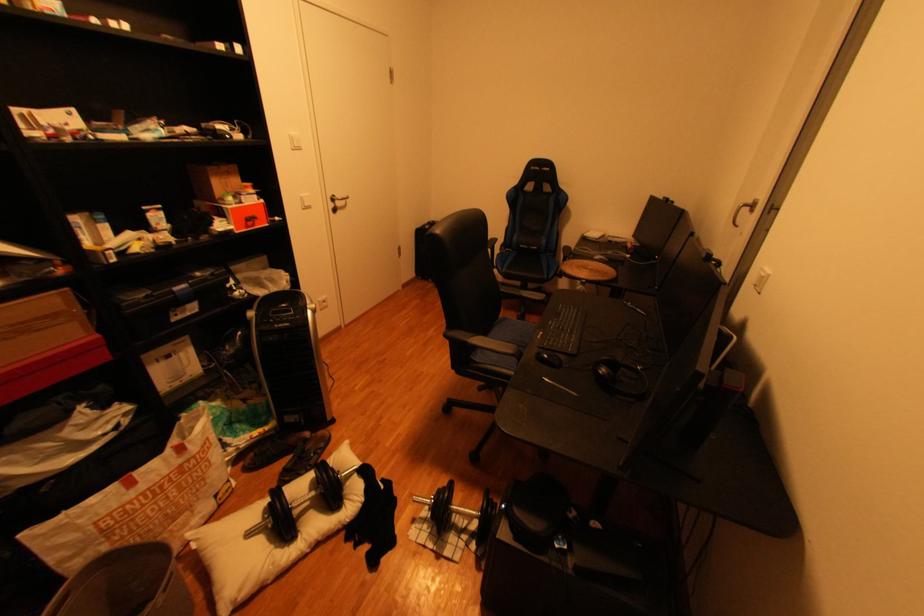
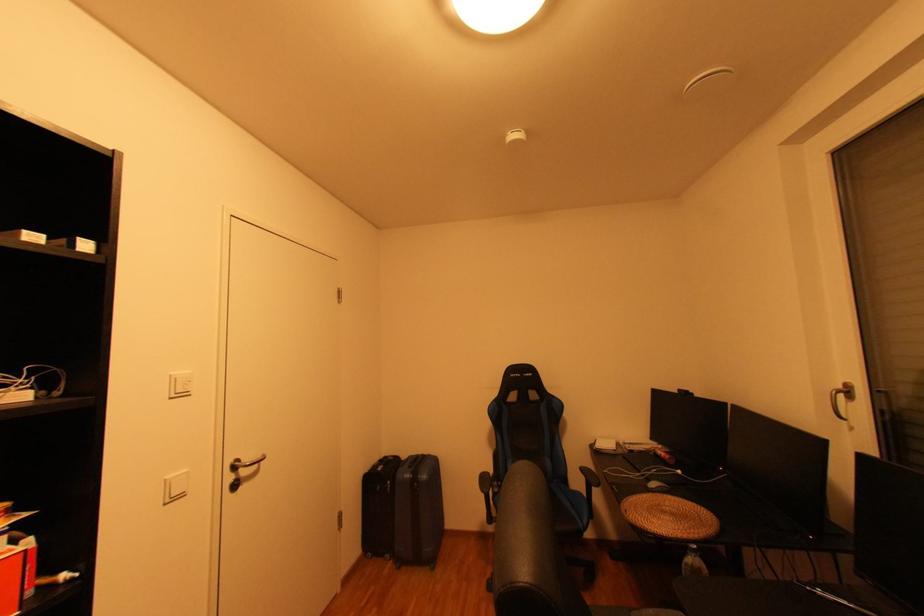
The images are taken continuously from a first-person perspective. In which direction is your viewpoint rotating?

The camera's rotation is toward right-up.